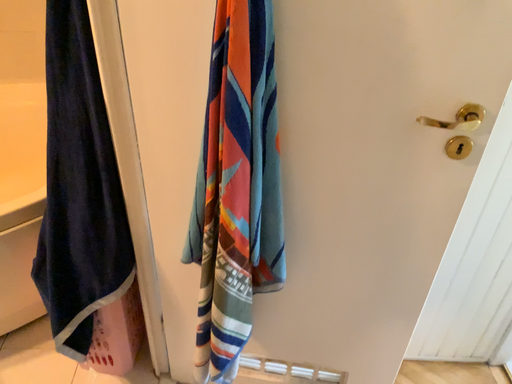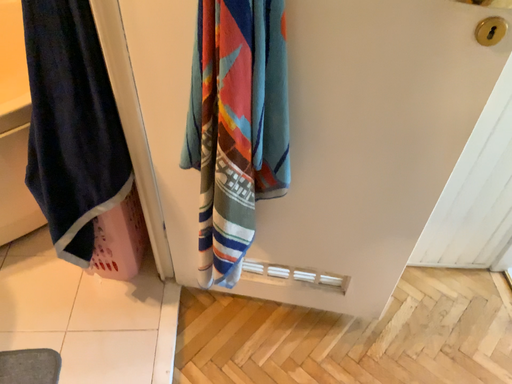
Question: How did the camera likely rotate when shooting the video?

Choices:
 (A) rotated downward
 (B) rotated upward

Answer: (A)